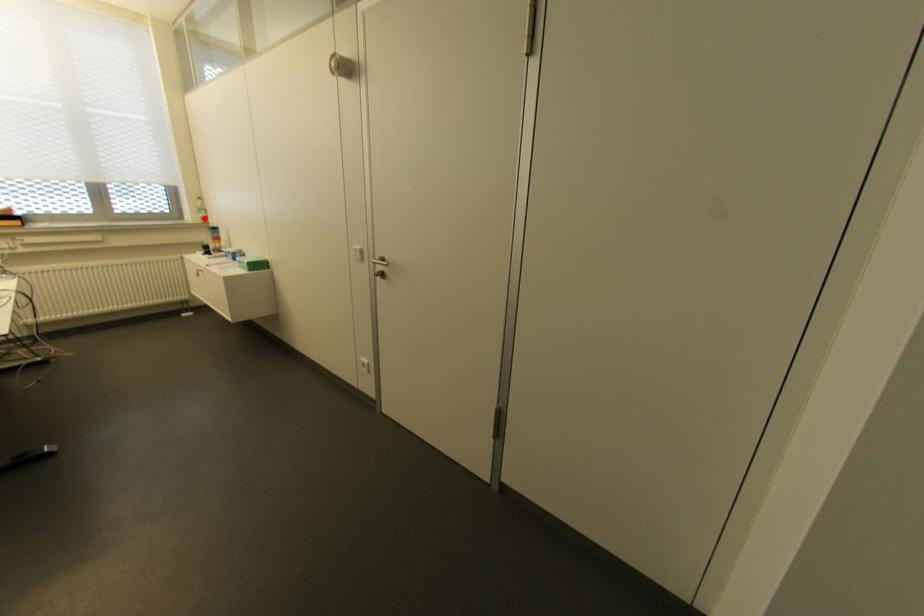
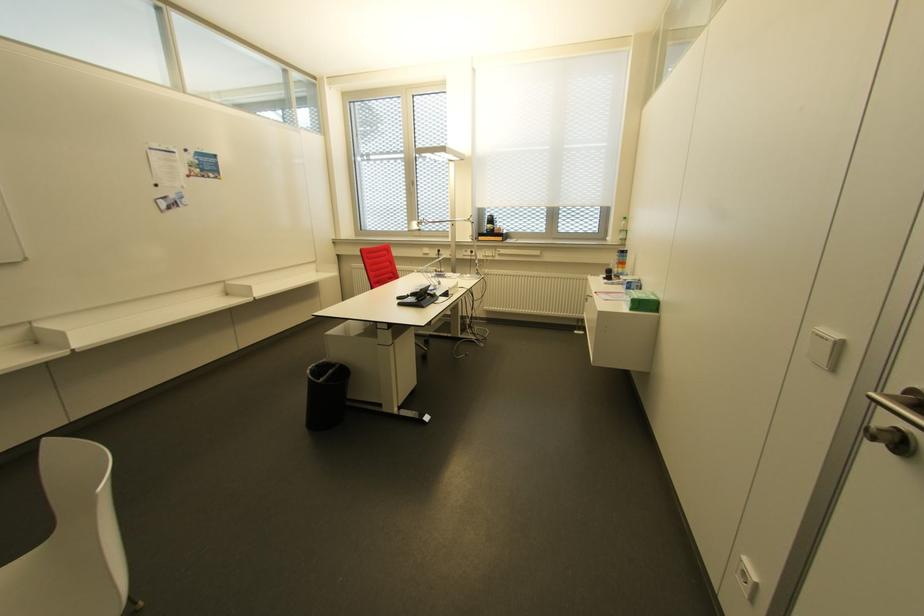
In the second image, find the point that corresponds to the highlighted location in the first image.

(623, 240)